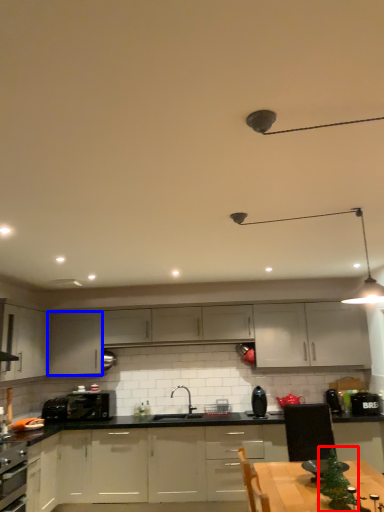
Question: Among these objects, which one is farthest to the camera, christmas tree (highlighted by a red box) or cabinetry (highlighted by a blue box)?

Choices:
 (A) christmas tree
 (B) cabinetry

Answer: (B)